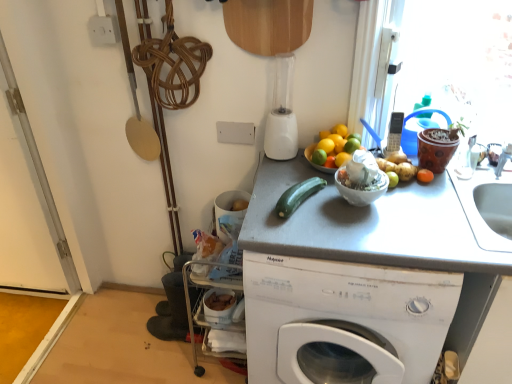
This screenshot has height=384, width=512. Find the location of `vacant area that is in front of yellow matte orange at center, which is the third orange from top to bottom`. vacant area that is in front of yellow matte orange at center, which is the third orange from top to bottom is located at coordinates (345, 208).